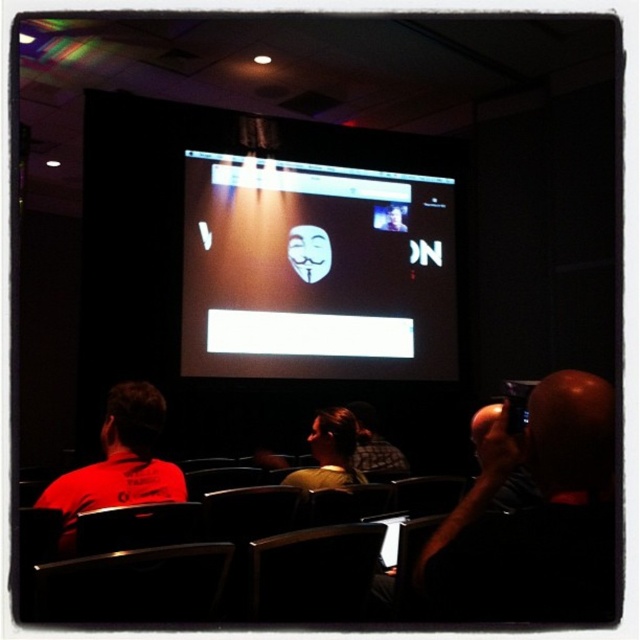
You are a photographer in the audience and want to take a photo of the screen. You notice two points marked on the screen at coordinates point (221, 205) and point (74, 500). Which point appears closer to your camera lens?

Point (221, 205) is further to the camera than point (74, 500), so the point (74, 500) is closer to the camera lens.

You are standing in the room facing the projection screen. There are two points marked in the image, one at coordinates point (342, 234) and the other at point (576, 512). Which point is closer to you?

Point (342, 234) is behind point (576, 512), so the point closer to you is point (576, 512).

You are an event organizer who needs to ensure that all attendees can see the presentation screen clearly. Considering the placement of the matte black mask at center and the red matte shirt at left, which object takes up more horizontal space in the image?

The matte black mask at center takes up more horizontal space than the red matte shirt at left because its width surpasses the shirt.